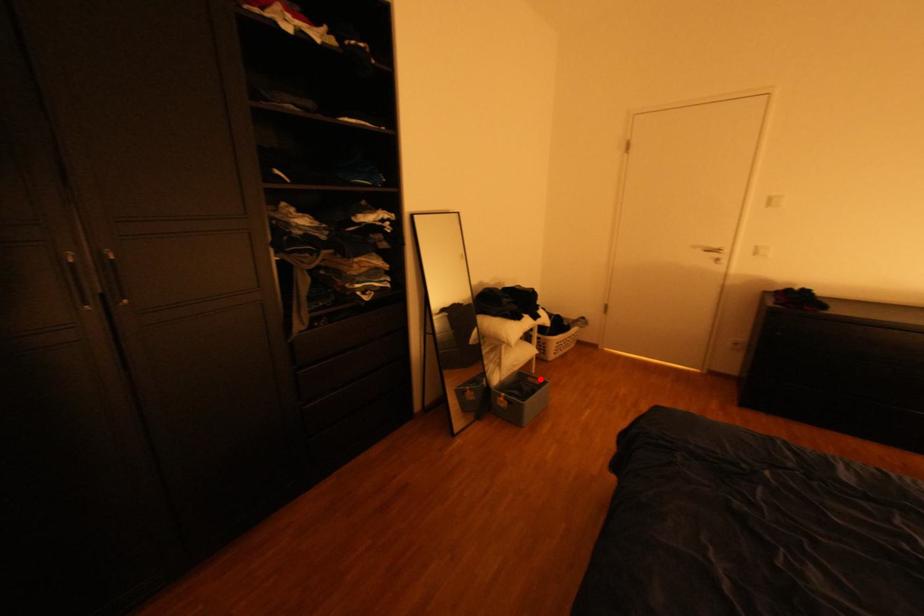
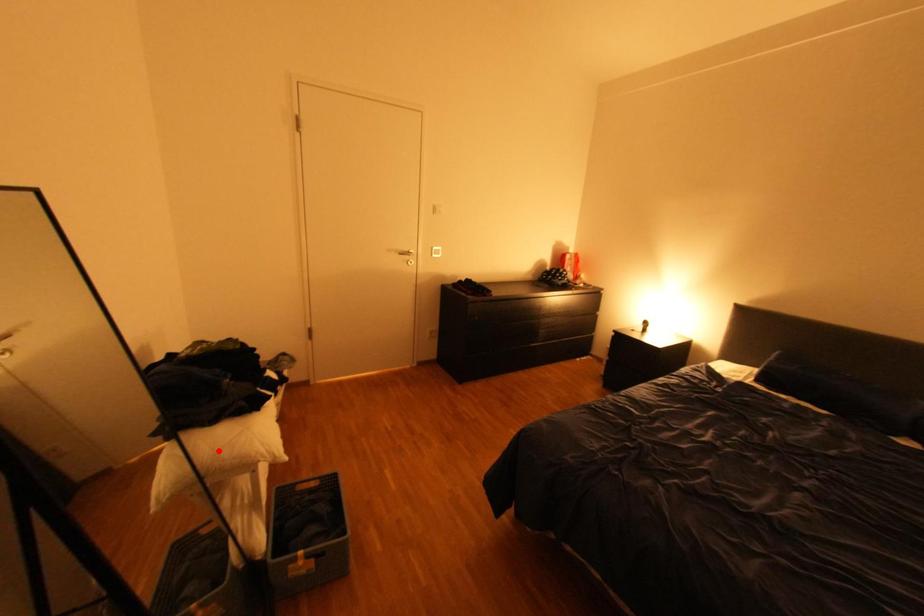
I am providing you with two images of the same scene from different viewpoints. A red point is marked on the first image and another point is marked on the second image. Does the point marked in image1 correspond to the same location as the one in image2?

No